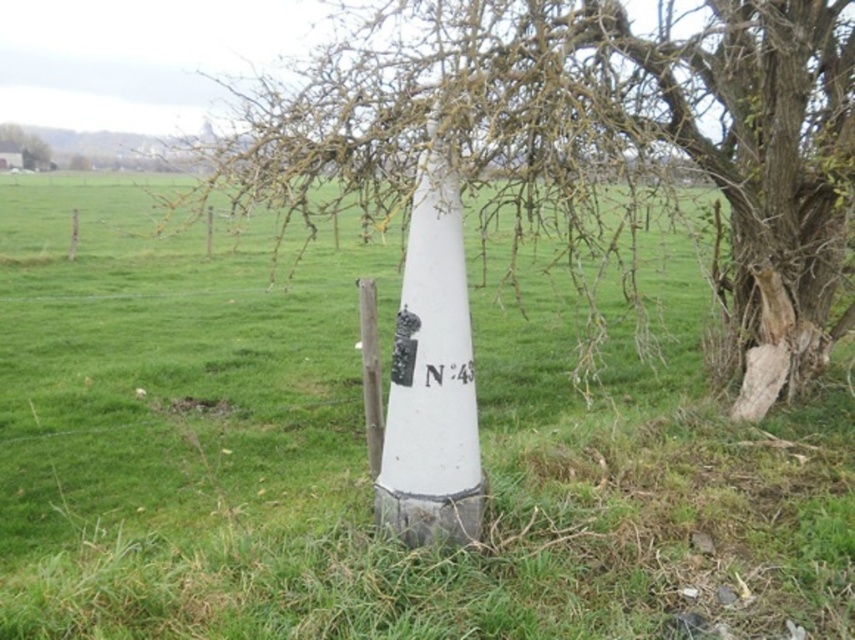
Between point (469, 67) and point (425, 380), which one is positioned behind?

The point (425, 380) is more distant.

Who is more distant from viewer, [764,70] or [469,381]?

The point [764,70] is more distant.

Locate an element on the screen. smooth bark tree at center is located at coordinates (591, 140).

Does smooth bark tree at center have a greater height compared to white painted wood post at center?

Correct, smooth bark tree at center is much taller as white painted wood post at center.

Can you confirm if smooth bark tree at center is positioned above white painted wood post at center?

Indeed, smooth bark tree at center is positioned over white painted wood post at center.

You are a GUI agent. You are given a task and a screenshot of the screen. Output one action in this format:
    pyautogui.click(x=<x>, y=<y>)
    Task: Click on the smooth bark tree at center
    This screenshot has width=855, height=640.
    Given the screenshot: What is the action you would take?
    pyautogui.click(x=591, y=140)

I want to click on smooth bark tree at center, so click(591, 140).

How distant is smooth bark tree at center from brown bark tree at upper left?

smooth bark tree at center is 19.29 meters away from brown bark tree at upper left.

Image resolution: width=855 pixels, height=640 pixels. Find the location of `smooth bark tree at center`. smooth bark tree at center is located at coordinates (591, 140).

The height and width of the screenshot is (640, 855). Find the location of `smooth bark tree at center`. smooth bark tree at center is located at coordinates tap(591, 140).